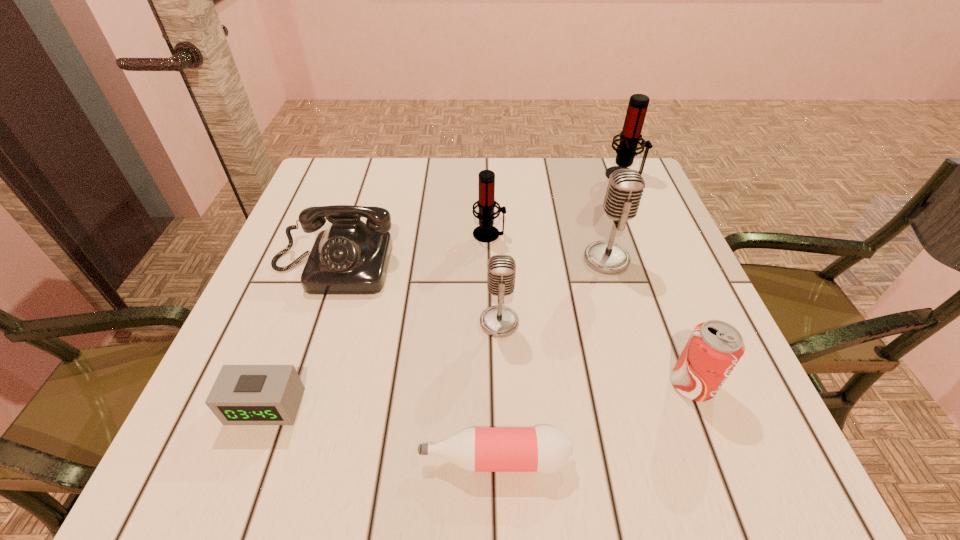
The width and height of the screenshot is (960, 540). Find the location of `object present at the far right corner`. object present at the far right corner is located at coordinates (630, 137).

You are a GUI agent. You are given a task and a screenshot of the screen. Output one action in this format:
    pyautogui.click(x=<x>, y=<y>)
    Task: Click on the vacant space at the far edge of the desktop
    
    Given the screenshot: What is the action you would take?
    tap(500, 173)

Locate an element on the screen. vacant area at the near edge of the desktop is located at coordinates (317, 434).

In the image, there is a desktop. At what (x,y) coordinates should I click in order to perform the action: click on free space at the left edge. Please return your answer as a coordinate pair (x, y). This screenshot has height=540, width=960. Looking at the image, I should click on (318, 344).

I want to click on vacant space at the right edge of the desktop, so click(690, 400).

The image size is (960, 540). In the image, there is a desktop. In order to click on vacant area at the far left corner in this screenshot , I will do `click(341, 179)`.

Locate an element on the screen. This screenshot has height=540, width=960. unoccupied position between the fifth farthest object and the alarm clock is located at coordinates (382, 364).

Identify the location of empty space that is in between the nearest object and the soda can. The image size is (960, 540). (593, 422).

Where is `vacant area between the nearest microphone and the bottle`? vacant area between the nearest microphone and the bottle is located at coordinates (496, 390).

At what (x,y) coordinates should I click in order to perform the action: click on free point between the smaller red microphone and the farthest microphone. Please return your answer as a coordinate pair (x, y). Looking at the image, I should click on (557, 205).